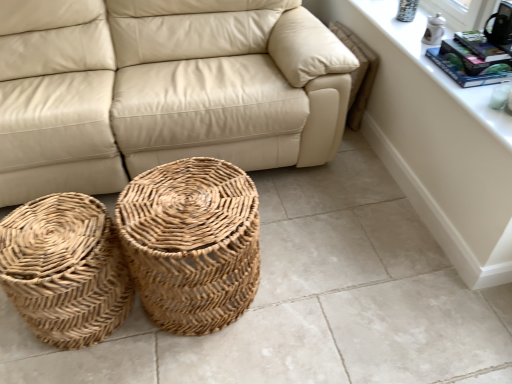
I want to click on vacant space in front of natural woven basket at center, which is counted as the 2th basket, starting from the left, so click(203, 362).